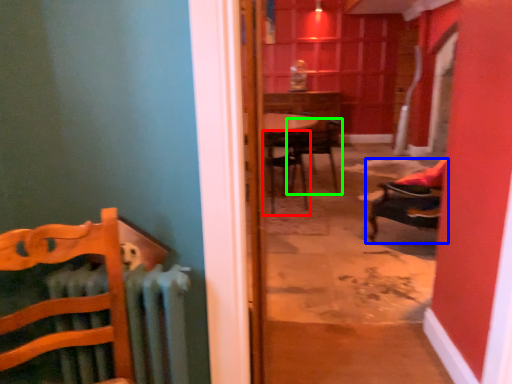
Question: Which object is positioned farthest from chair (highlighted by a red box)? Select from chair (highlighted by a blue box) and chair (highlighted by a green box).

Choices:
 (A) chair
 (B) chair

Answer: (A)